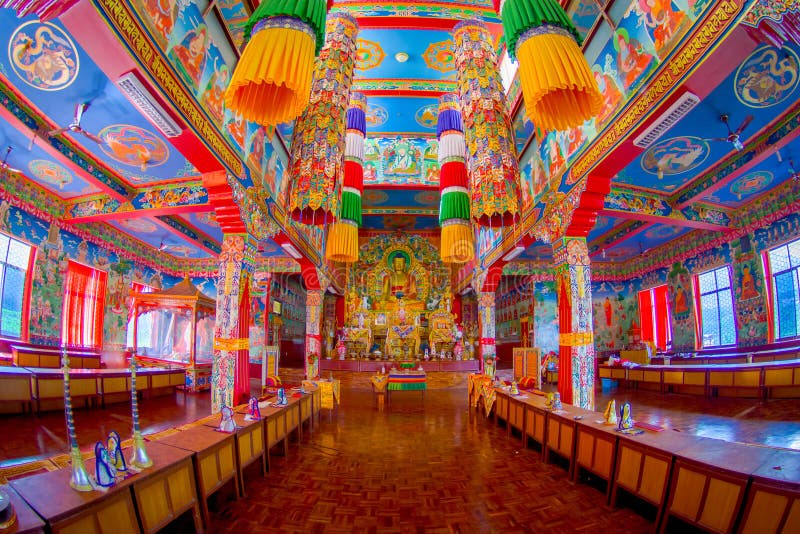
Locate an element on the screen. multicolored table covering is located at coordinates (413, 375).